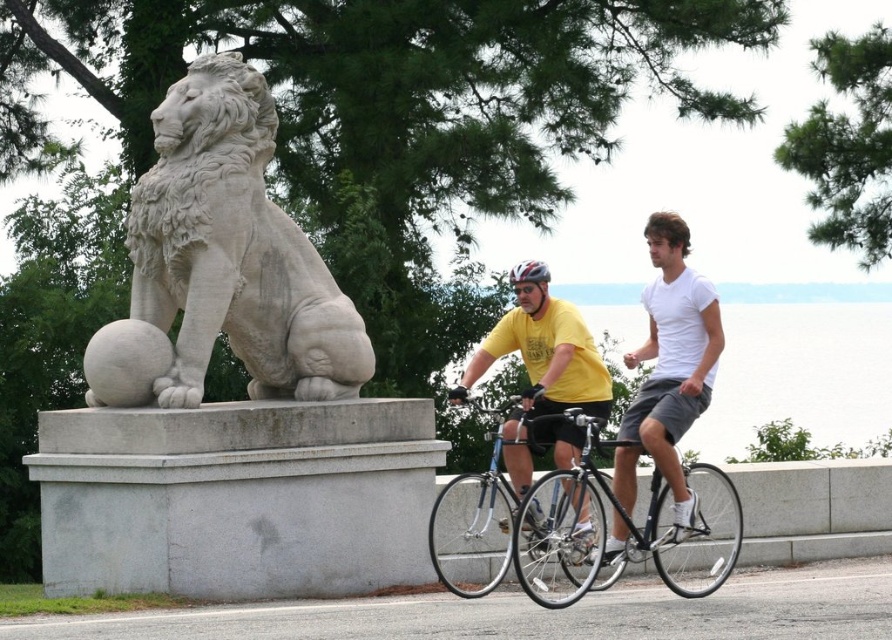
You are a photographer positioned at the edge of the path. You want to take a photo of the cyclists so that the white cotton shirt at center and the shiny blue frame at center appear side by side in the frame. Based on their positions, which object should you place closer to the left side of the photo?

Since the white cotton shirt at center is to the right of the shiny blue frame at center, you should position the shiny blue frame at center closer to the left side of the photo to have them appear side by side.